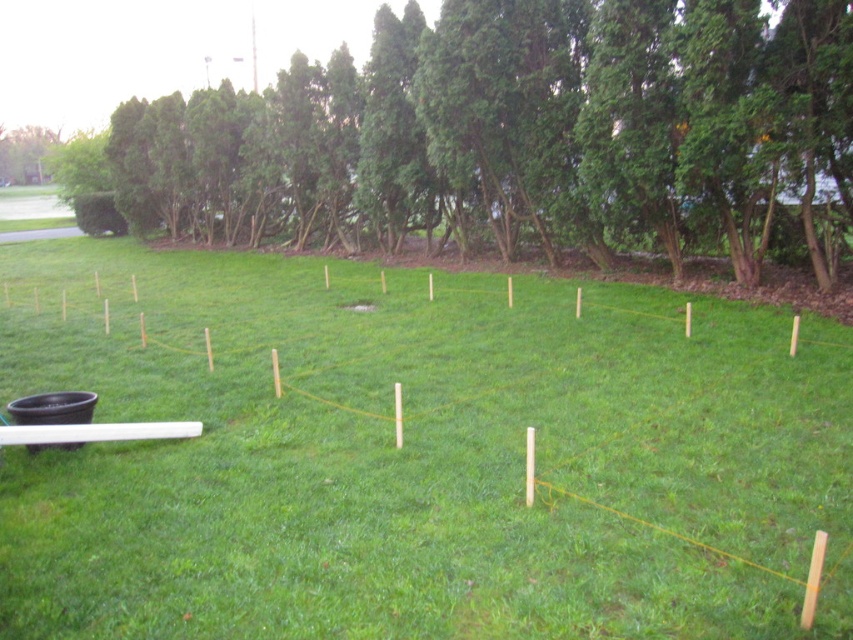
Question: Does green grass at center appear under green leafy tree at upper left?

Choices:
 (A) no
 (B) yes

Answer: (B)

Question: Which point appears closest to the camera in this image?

Choices:
 (A) (1, 145)
 (B) (730, 589)

Answer: (B)

Question: Considering the relative positions of green leafy tree at upper center and green leafy tree at upper left in the image provided, where is green leafy tree at upper center located with respect to green leafy tree at upper left?

Choices:
 (A) left
 (B) right

Answer: (B)

Question: Is green leafy tree at upper center bigger than green leafy tree at upper left?

Choices:
 (A) yes
 (B) no

Answer: (A)

Question: Which point is farther from the camera taking this photo?

Choices:
 (A) (96, 464)
 (B) (45, 150)
 (C) (421, 16)

Answer: (B)

Question: Which of the following is the farthest from the observer?

Choices:
 (A) (172, 204)
 (B) (32, 129)
 (C) (248, 456)

Answer: (B)